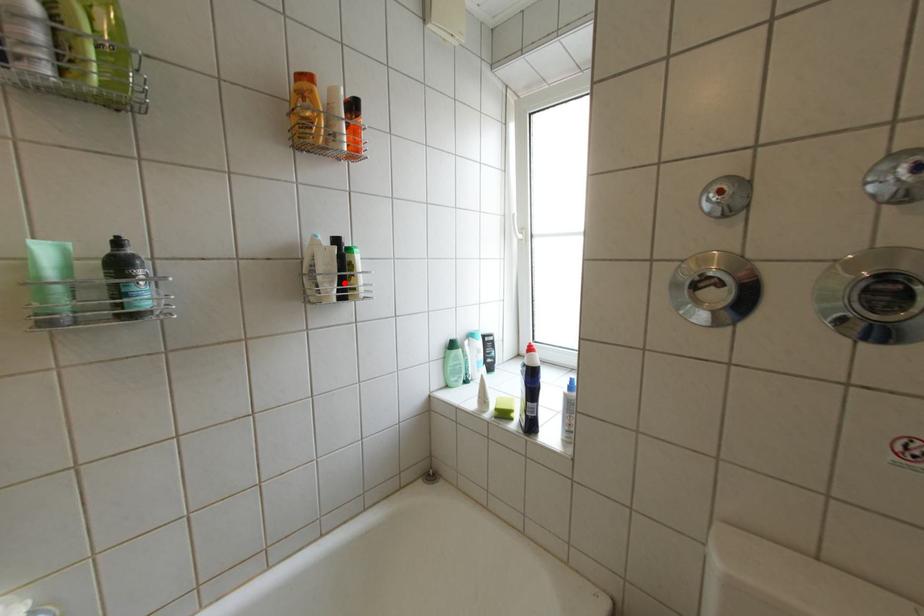
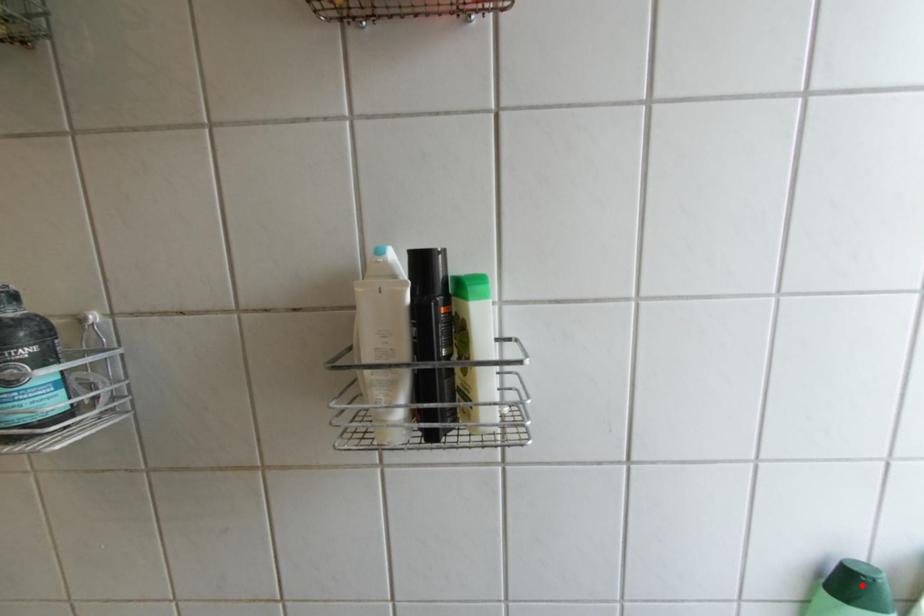
I am providing you with two images of the same scene from different viewpoints. A red point is marked on the first image and another point is marked on the second image. Are the points marked in image1 and image2 representing the same 3D position?

No